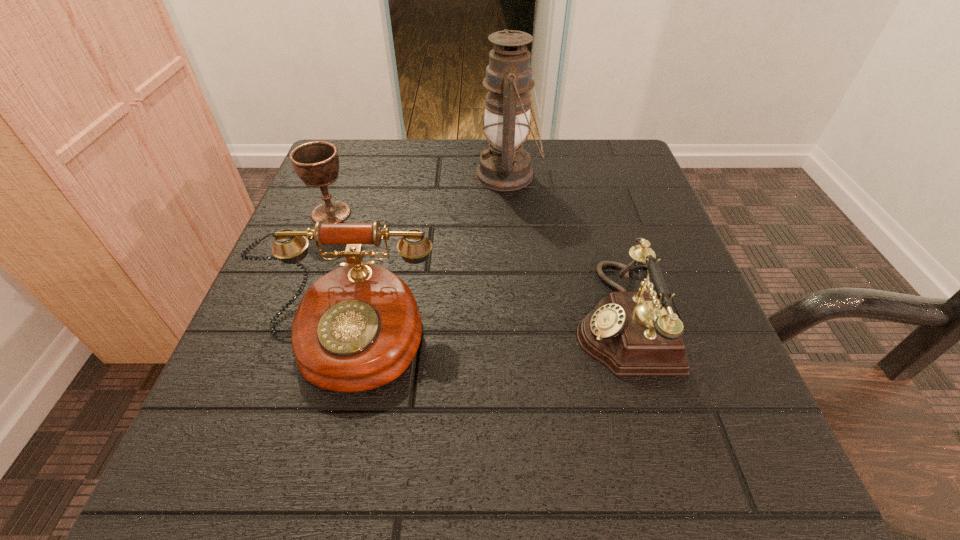
The image size is (960, 540). What are the coordinates of `oil lamp` in the screenshot? It's located at pos(504,166).

Locate an element on the screen. the second object from right to left is located at coordinates (504, 166).

The height and width of the screenshot is (540, 960). I want to click on the taller telephone, so click(357, 328).

In order to click on the second tallest object in this screenshot , I will do `click(357, 328)`.

Identify the location of chalice. Image resolution: width=960 pixels, height=540 pixels. (316, 163).

Identify the location of the rightmost object. (631, 333).

Image resolution: width=960 pixels, height=540 pixels. I want to click on the shorter telephone, so click(x=631, y=333).

Identify the location of free spot located on the right of the third object from left to right. 636,175.

Locate an element on the screen. This screenshot has height=540, width=960. free space located 0.080m on the dial of the taller telephone is located at coordinates (315, 454).

You are a GUI agent. You are given a task and a screenshot of the screen. Output one action in this format:
    pyautogui.click(x=<x>, y=<y>)
    Task: Click on the free space located on the front of the chalice
    
    Given the screenshot: What is the action you would take?
    pyautogui.click(x=261, y=397)